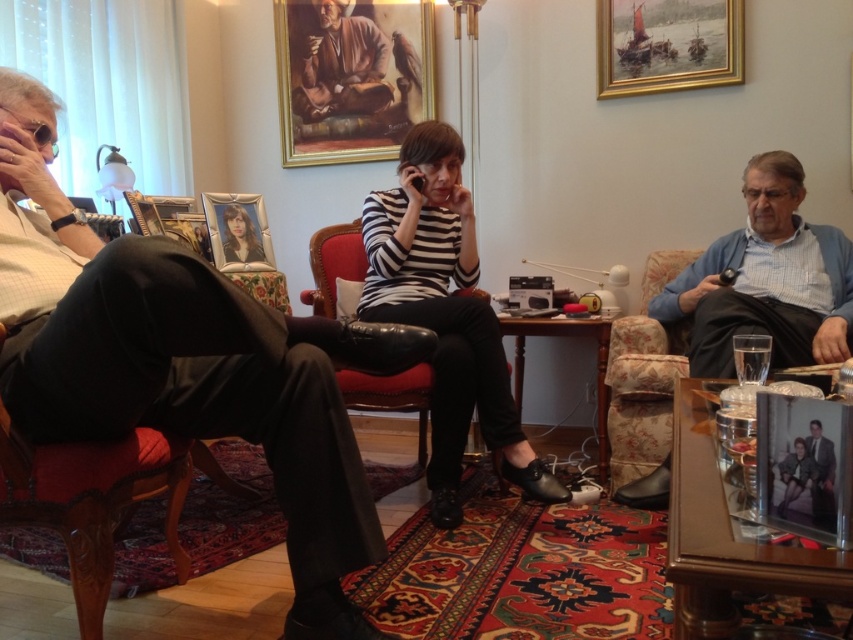
Is blue cotton sweater at right smaller than brown textured robe at upper center?

No, blue cotton sweater at right is not smaller than brown textured robe at upper center.

Which is in front, point (827, 273) or point (294, 88)?

Point (827, 273) is more forward.

Where is `blue cotton sweater at right`? The image size is (853, 640). blue cotton sweater at right is located at coordinates (766, 280).

Is point (286, 424) less distant than point (335, 253)?

Yes, it is in front of point (335, 253).

Can you confirm if matte black pants at left is shorter than leather at center?

No, matte black pants at left is not shorter than leather at center.

Is point (305, 369) behind point (463, 390)?

No.

Locate an element on the screen. The image size is (853, 640). matte black pants at left is located at coordinates (184, 362).

Which is above, striped fabric shirt at center or matte black frame at center?

matte black frame at center is higher up.

Consider the image. Is striped fabric shirt at center wider than matte black frame at center?

Yes.

Describe the element at coordinates (445, 314) in the screenshot. I see `striped fabric shirt at center` at that location.

You are a GUI agent. You are given a task and a screenshot of the screen. Output one action in this format:
    pyautogui.click(x=<x>, y=<y>)
    Task: Click on the striped fabric shirt at center
    
    Given the screenshot: What is the action you would take?
    pyautogui.click(x=445, y=314)